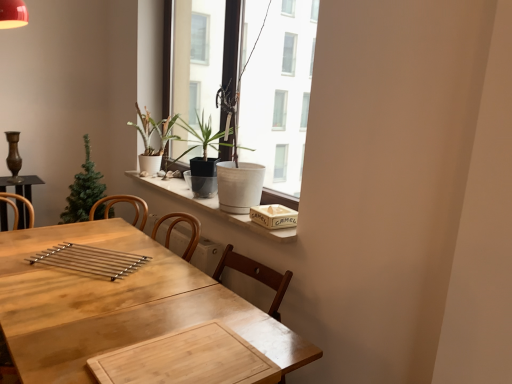
The width and height of the screenshot is (512, 384). What do you see at coordinates (273, 216) in the screenshot? I see `wooden textured book at upper right` at bounding box center [273, 216].

Locate an element on the screen. The width and height of the screenshot is (512, 384). green matte christmas tree at left, which is counted as the first houseplant, starting from the left is located at coordinates (83, 190).

The height and width of the screenshot is (384, 512). What do you see at coordinates (117, 305) in the screenshot? I see `wooden table at center` at bounding box center [117, 305].

Looking at this image, measure the distance between point (135,259) and camera.

Point (135,259) is 1.99 meters from camera.

Image resolution: width=512 pixels, height=384 pixels. What are the coordinates of `white marble window sill at upper center` in the screenshot? It's located at (214, 207).

From a real-world perspective, is white matte pot at upper center physically located above or below matte white pot at window, positioned as the 2th houseplant in left-to-right order?

white matte pot at upper center is above matte white pot at window, positioned as the 2th houseplant in left-to-right order.

Is white matte pot at upper center at the right side of matte white pot at window, the 2th houseplant viewed from the right?

Yes, white matte pot at upper center is to the right of matte white pot at window, the 2th houseplant viewed from the right.

Is point (176, 86) behind point (165, 142)?

Yes, it is.

Based on the photo, can you confirm if white matte pot at upper center is taller than matte white pot at window, positioned as the 2th houseplant in left-to-right order?

Correct, white matte pot at upper center is much taller as matte white pot at window, positioned as the 2th houseplant in left-to-right order.

Between white matte pot at upper center and white marble window sill at upper center, which one is positioned in front?

Positioned in front is white marble window sill at upper center.

Considering the relative sizes of white matte pot at upper center and white marble window sill at upper center in the image provided, is white matte pot at upper center thinner than white marble window sill at upper center?

Indeed, white matte pot at upper center has a lesser width compared to white marble window sill at upper center.

Which point is more forward, (283, 88) or (234, 222)?

The point (234, 222) is in front.

Who is taller, white matte pot at upper center or white marble window sill at upper center?

white matte pot at upper center is taller.

Is white marble window sill at upper center turned away from white matte pot at upper center?

No, white marble window sill at upper center is not facing the opposite direction of white matte pot at upper center.

Considering the sizes of objects white marble window sill at upper center and white matte pot at upper center in the image provided, who is taller, white marble window sill at upper center or white matte pot at upper center?

white matte pot at upper center.

Locate an element on the screen. The height and width of the screenshot is (384, 512). window located on the right of white marble window sill at upper center is located at coordinates (251, 79).

Is white marble window sill at upper center to the right of white matte pot at upper center from the viewer's perspective?

Incorrect, white marble window sill at upper center is not on the right side of white matte pot at upper center.

How much distance is there between wooden table at center and polished metal tray at center?

They are 22.99 centimeters apart.

Is point (4, 266) closer or farther from the camera than point (94, 254)?

Point (4, 266).

From the image's perspective, does wooden table at center appear higher than polished metal tray at center?

Incorrect, from the image's perspective, wooden table at center is lower than polished metal tray at center.

Would you say wooden table at center is outside polished metal tray at center?

Yes.

From a real-world perspective, which houseplant is the 2nd one above the polished metal tray at center? Please provide its 2D coordinates.

[(150, 139)]

From the image's perspective, is matte white pot at window, the 2th houseplant viewed from the right, on top of polished metal tray at center?

Yes.

Can you tell me how much matte white pot at window, positioned as the 2th houseplant in left-to-right order, and polished metal tray at center differ in facing direction?

There is a 35.4-degree angle between the facing directions of matte white pot at window, positioned as the 2th houseplant in left-to-right order, and polished metal tray at center.

Looking at this image, is matte white pot at window, positioned as the 2th houseplant in left-to-right order, taller than polished metal tray at center?

Yes, matte white pot at window, positioned as the 2th houseplant in left-to-right order, is taller than polished metal tray at center.

From the picture: Between green matte christmas tree at left, the 3th houseplant in the right-to-left sequence, and white marble window sill at upper center, which one has less height?

white marble window sill at upper center is shorter.

From the image's perspective, which houseplant is the 1st one above the white marble window sill at upper center? Please provide its 2D coordinates.

[(83, 190)]

Which is closer to the camera, (71, 205) or (233, 214)?

The point (233, 214) is closer.

Considering the sizes of green matte christmas tree at left, the 3th houseplant in the right-to-left sequence, and white marble window sill at upper center in the image, is green matte christmas tree at left, the 3th houseplant in the right-to-left sequence, wider or thinner than white marble window sill at upper center?

Clearly, green matte christmas tree at left, the 3th houseplant in the right-to-left sequence, has more width compared to white marble window sill at upper center.

From a real-world perspective, is wooden textured book at upper right on top of polished metal tray at center?

Indeed, from a real-world perspective, wooden textured book at upper right stands above polished metal tray at center.

From the image's perspective, is wooden textured book at upper right above or below polished metal tray at center?

Clearly, from the image's perspective, wooden textured book at upper right is above polished metal tray at center.

Is the position of wooden textured book at upper right less distant than that of polished metal tray at center?

→ No, wooden textured book at upper right is further to the viewer.

What are the coordinates of `window in front of the matte white pot at window, the 2th houseplant viewed from the right` in the screenshot? It's located at (251, 79).

Where is `window sill that is below the white matte pot at upper center (from the image's perspective)`? window sill that is below the white matte pot at upper center (from the image's perspective) is located at coordinates (214, 207).

When comparing their distances from green matte christmas tree at left, the 3th houseplant in the right-to-left sequence, does polished metal tray at center or white matte pot at upper center seem closer?

polished metal tray at center lies closer to green matte christmas tree at left, the 3th houseplant in the right-to-left sequence, than the other object.

When comparing their distances from white marble window sill at upper center, does polished metal tray at center or wooden textured book at upper right seem closer?

Among the two, wooden textured book at upper right is located nearer to white marble window sill at upper center.

Considering their positions, is matte white pot at window, the 2th houseplant viewed from the right, positioned further to polished metal tray at center than wooden table at center?

matte white pot at window, the 2th houseplant viewed from the right, is positioned further to the anchor polished metal tray at center.

Based on their spatial positions, is polished metal tray at center or white marble window sill at upper center closer to wooden table at center?

polished metal tray at center is positioned closer to the anchor wooden table at center.

From the image, which object appears to be nearer to matte white pot at window, the 2th houseplant viewed from the right, white marble window sill at upper center or green matte christmas tree at left, the 3th houseplant in the right-to-left sequence?

white marble window sill at upper center is positioned closer to the anchor matte white pot at window, the 2th houseplant viewed from the right.

Which object lies further to the anchor point white marble window sill at upper center, white matte pot at upper center or wooden table at center?

Among the two, white matte pot at upper center is located further to white marble window sill at upper center.

Looking at the image, which one is located further to green matte christmas tree at left, the 3th houseplant in the right-to-left sequence, matte white pot at window, the 2th houseplant viewed from the right, or matte black pot at center, arranged as the 3th houseplant when viewed from the left?

Among the two, matte black pot at center, arranged as the 3th houseplant when viewed from the left, is located further to green matte christmas tree at left, the 3th houseplant in the right-to-left sequence.

Based on their spatial positions, is green matte christmas tree at left, the 3th houseplant in the right-to-left sequence, or matte black pot at center, arranged as the 3th houseplant when viewed from the left, closer to wooden textured book at upper right?

matte black pot at center, arranged as the 3th houseplant when viewed from the left.

At what (x,y) coordinates should I click in order to perform the action: click on window between white marble window sill at upper center and matte white pot at window, positioned as the 2th houseplant in left-to-right order, from front to back. Please return your answer as a coordinate pair (x, y). The height and width of the screenshot is (384, 512). Looking at the image, I should click on (251, 79).

Find the location of a particular element. The image size is (512, 384). houseplant between matte white pot at window, positioned as the 2th houseplant in left-to-right order, and wooden textured book at upper right from left to right is located at coordinates (203, 156).

Locate an element on the screen. The width and height of the screenshot is (512, 384). book between white matte pot at upper center and matte white pot at window, the 2th houseplant viewed from the right, in the front-back direction is located at coordinates (273, 216).

At what (x,y) coordinates should I click in order to perform the action: click on book between white matte pot at upper center and wooden table at center from top to bottom. Please return your answer as a coordinate pair (x, y). The image size is (512, 384). Looking at the image, I should click on (273, 216).